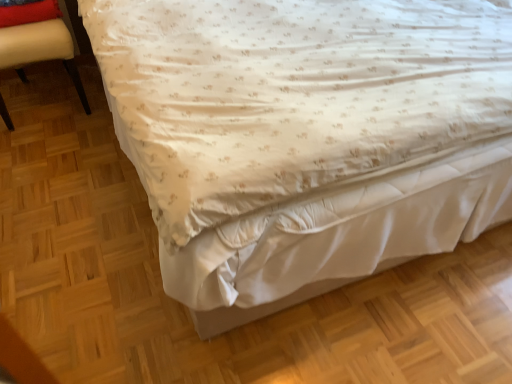
Locate an element on the screen. This screenshot has height=384, width=512. free space below beige leather chair at left (from a real-world perspective) is located at coordinates (51, 96).